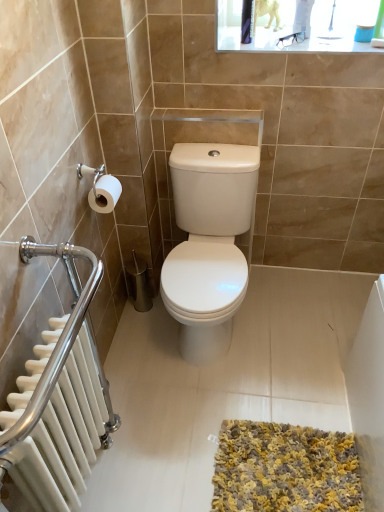
I want to click on vacant space behind yellow-grey shaggy bath mat at lower center, so click(x=260, y=372).